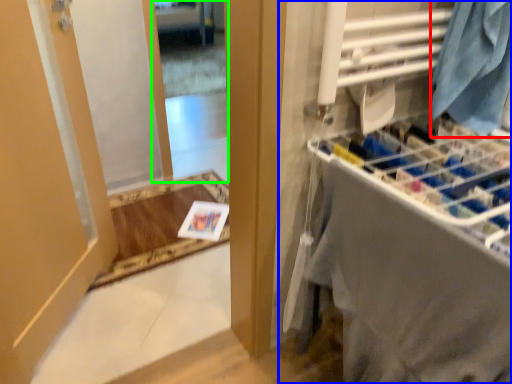
Question: Considering the real-world distances, which object is farthest from clothing (highlighted by a red box)? closet (highlighted by a blue box) or mirror (highlighted by a green box)?

Choices:
 (A) closet
 (B) mirror

Answer: (B)